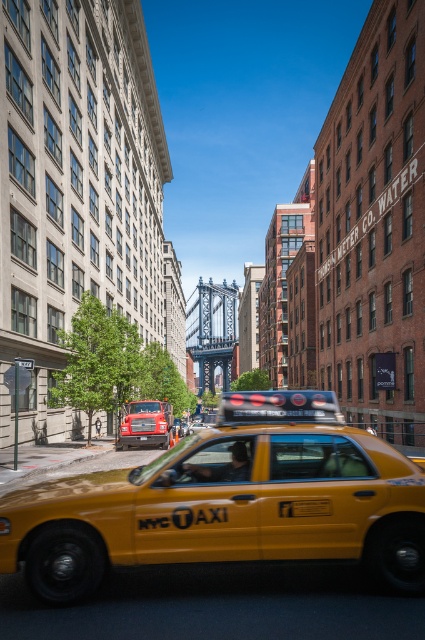
Between yellow matte taxi at center and yellow matte taxi cab at center, which one appears on the right side from the viewer's perspective?

yellow matte taxi at center is more to the right.

Between point (234, 506) and point (195, 429), which one is positioned behind?

Positioned behind is point (195, 429).

Which is behind, point (218, 554) or point (200, 426)?

The point (200, 426) is more distant.

Locate an element on the screen. This screenshot has width=425, height=640. yellow matte taxi at center is located at coordinates (229, 502).

Between yellow rubber nyc taxi at center and yellow matte taxi cab at center, which one is positioned lower?

yellow matte taxi cab at center

Is yellow rubber nyc taxi at center below yellow matte taxi cab at center?

Actually, yellow rubber nyc taxi at center is above yellow matte taxi cab at center.

Who is more distant from viewer, (129, 419) or (190, 424)?

Point (190, 424)

Image resolution: width=425 pixels, height=640 pixels. I want to click on yellow rubber nyc taxi at center, so click(147, 422).

Is yellow matte taxi at center taller than yellow rubber nyc taxi at center?

Correct, yellow matte taxi at center is much taller as yellow rubber nyc taxi at center.

Is point (317, 465) positioned in front of point (164, 426)?

Yes.

What do you see at coordinates (229, 502) in the screenshot? I see `yellow matte taxi at center` at bounding box center [229, 502].

Where is `yellow matte taxi at center`? This screenshot has width=425, height=640. yellow matte taxi at center is located at coordinates (229, 502).